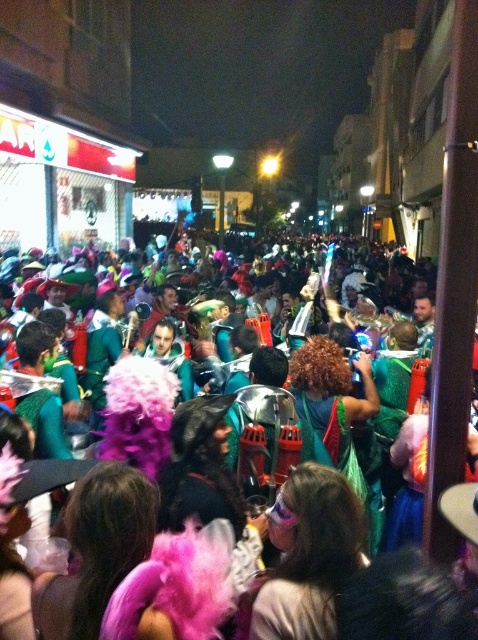
Question: Can you confirm if fuzzy pink boa at center is wider than shiny pink wig at center?

Choices:
 (A) no
 (B) yes

Answer: (B)

Question: Does fuzzy pink boa at center lie in front of shiny pink wig at center?

Choices:
 (A) no
 (B) yes

Answer: (A)

Question: Which of the following is the closest to the observer?

Choices:
 (A) shiny pink wig at center
 (B) fuzzy pink boa at center

Answer: (A)

Question: Can you confirm if fuzzy pink boa at center is positioned above shiny pink wig at center?

Choices:
 (A) yes
 (B) no

Answer: (A)

Question: Which object is farther from the camera taking this photo?

Choices:
 (A) fuzzy pink boa at center
 (B) shiny pink wig at center

Answer: (A)